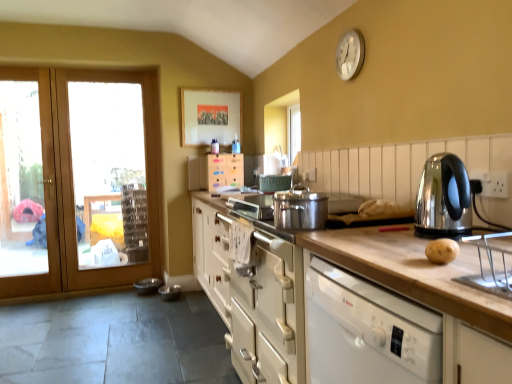
The width and height of the screenshot is (512, 384). I want to click on clear glass door at left, so click(x=108, y=173).

This screenshot has width=512, height=384. What do you see at coordinates (414, 273) in the screenshot?
I see `wooden at right` at bounding box center [414, 273].

What are the coordinates of `white wood cabinet at center, the 1th cabinetry when ordered from top to bottom` in the screenshot? It's located at (225, 171).

Can you see clear glass door at left touching clear glass door at left?

clear glass door at left and clear glass door at left are not in contact.

Considering the relative sizes of clear glass door at left and clear glass door at left in the image provided, is clear glass door at left thinner than clear glass door at left?

Indeed, clear glass door at left has a lesser width compared to clear glass door at left.

Looking at this image, would you say clear glass door at left is to the left or to the right of clear glass door at left in the picture?

clear glass door at left is positioned on clear glass door at left's right side.

Is wooden door at left wider than smooth yellow potato at right?

No, wooden door at left is not wider than smooth yellow potato at right.

Which object is more forward, wooden door at left or smooth yellow potato at right?

smooth yellow potato at right is in front.

Which of these two, wooden door at left or smooth yellow potato at right, is smaller?

Smaller between the two is smooth yellow potato at right.

Is there a large distance between wooden door at left and smooth yellow potato at right?

Yes, wooden door at left and smooth yellow potato at right are located far from each other.

From the image's perspective, which is below, shiny metallic kettle at right or clear glass door at left?

shiny metallic kettle at right appears lower in the image.

Can you see shiny metallic kettle at right touching clear glass door at left?

shiny metallic kettle at right and clear glass door at left are clearly separated.

Is shiny metallic kettle at right facing away from clear glass door at left?

No.

Is shiny metallic kettle at right spatially inside clear glass door at left, or outside of it?

shiny metallic kettle at right is spatially situated outside clear glass door at left.

In terms of width, does smooth yellow potato at right look wider or thinner when compared to matte wooden picture frame at upper center?

smooth yellow potato at right is wider than matte wooden picture frame at upper center.

Looking at this image, from the image's perspective, is smooth yellow potato at right located beneath matte wooden picture frame at upper center?

Yes.

Is smooth yellow potato at right situated inside matte wooden picture frame at upper center or outside?

smooth yellow potato at right is not enclosed by matte wooden picture frame at upper center.

Is smooth yellow potato at right bigger or smaller than matte wooden picture frame at upper center?

Clearly, smooth yellow potato at right is smaller in size than matte wooden picture frame at upper center.

From the picture: Is white wood cabinet at center, the second cabinetry in the front-to-back sequence, situated inside clear glass door at left or outside?

white wood cabinet at center, the second cabinetry in the front-to-back sequence, is outside clear glass door at left.

Is white wood cabinet at center, which is the 1th cabinetry from left to right, wider or thinner than clear glass door at left?

Clearly, white wood cabinet at center, which is the 1th cabinetry from left to right, has more width compared to clear glass door at left.

Between white wood cabinet at center, the 1th cabinetry when ordered from top to bottom, and clear glass door at left, which one appears on the left side from the viewer's perspective?

Positioned to the left is clear glass door at left.

Is white wood cabinet at center, which appears as the 2th cabinetry when viewed from the right, positioned with its back to clear glass door at left?

That's not correct — white wood cabinet at center, which appears as the 2th cabinetry when viewed from the right, is not looking away from clear glass door at left.

Is metallic stainless steel bowl at lower left, acting as the first appliance starting from the left, not inside white metallic clock at upper right?

metallic stainless steel bowl at lower left, acting as the first appliance starting from the left, is positioned outside white metallic clock at upper right.

From the image's perspective, does metallic stainless steel bowl at lower left, acting as the first appliance starting from the left, appear lower than white metallic clock at upper right?

Yes, from the image's perspective, metallic stainless steel bowl at lower left, acting as the first appliance starting from the left, is below white metallic clock at upper right.

Is point (162, 281) positioned before point (349, 62)?

That is False.

In the scene shown: Are clear glass door at left and matte wooden picture frame at upper center beside each other?

They are not placed beside each other.

Considering the positions of point (3, 94) and point (220, 140), is point (3, 94) closer or farther from the camera than point (220, 140)?

Point (3, 94).

You are a GUI agent. You are given a task and a screenshot of the screen. Output one action in this format:
    pyautogui.click(x=<x>, y=<y>)
    Task: Click on the screen door that is on the left side of matte wooden picture frame at upper center
    
    Given the screenshot: What is the action you would take?
    pyautogui.click(x=27, y=185)

Locate an element on the screen. Image resolution: width=512 pixels, height=384 pixels. window above the clear glass door at left (from the image's perspective) is located at coordinates (108, 173).

Find the location of a particular element. potato below the wooden door at left (from a real-world perspective) is located at coordinates (442, 251).

From the image, which object appears to be nearer to smooth yellow potato at right, white matte cabinet at center, marked as the 1th cabinetry in a right-to-left arrangement, or shiny metallic kettle at right?

Among the two, shiny metallic kettle at right is located nearer to smooth yellow potato at right.

From the image, which object appears to be farther from wooden door at left, shiny metallic kettle at right or smooth yellow potato at right?

smooth yellow potato at right is positioned further to the anchor wooden door at left.

Considering their positions, is shiny metallic kettle at right positioned closer to smooth yellow potato at right than wooden door at left?

Based on the image, shiny metallic kettle at right appears to be nearer to smooth yellow potato at right.

Looking at this image, which object lies nearer to the anchor point clear glass door at left, clear glass door at left or white matte cabinet at center, which ranks as the 2th cabinetry in top-to-bottom order?

clear glass door at left.

Based on their spatial positions, is metallic stainless steel bowl at lower left, acting as the first appliance starting from the left, or clear glass door at left closer to shiny metallic kettle at right?

Based on the image, metallic stainless steel bowl at lower left, acting as the first appliance starting from the left, appears to be nearer to shiny metallic kettle at right.

Based on their spatial positions, is smooth yellow potato at right or white matte cabinet at center, the 2th cabinetry when ordered from back to front, closer to wooden door at left?

white matte cabinet at center, the 2th cabinetry when ordered from back to front, lies closer to wooden door at left than the other object.

Which object lies further to the anchor point shiny metallic kettle at right, white wood cabinet at center, the second cabinetry in the front-to-back sequence, or smooth yellow potato at right?

white wood cabinet at center, the second cabinetry in the front-to-back sequence, is further to shiny metallic kettle at right.

Consider the image. Based on their spatial positions, is shiny metallic kettle at right or metallic silver bowl at lower left, acting as the second appliance starting from the left, closer to clear glass door at left?

The object closer to clear glass door at left is metallic silver bowl at lower left, acting as the second appliance starting from the left.

This screenshot has height=384, width=512. I want to click on door between smooth yellow potato at right and metallic stainless steel bowl at lower left, acting as the first appliance starting from the left, in the front-back direction, so click(x=90, y=179).

Locate an element on the screen. This screenshot has width=512, height=384. appliance positioned between smooth yellow potato at right and clear glass door at left from near to far is located at coordinates (170, 292).

This screenshot has height=384, width=512. Identify the location of potato between clear glass door at left and shiny metallic kettle at right in the horizontal direction. (442, 251).

You are a GUI agent. You are given a task and a screenshot of the screen. Output one action in this format:
    pyautogui.click(x=<x>, y=<y>)
    Task: Click on the picture frame between clear glass door at left and white metallic clock at upper right from left to right
    The height and width of the screenshot is (384, 512).
    Given the screenshot: What is the action you would take?
    pyautogui.click(x=210, y=116)